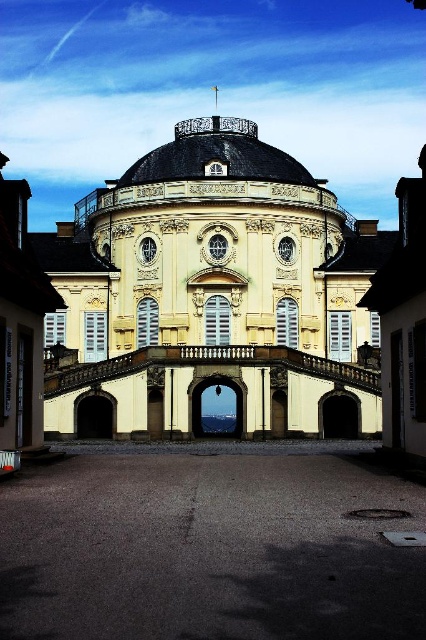
You are standing on the gray asphalt at center looking up at the beige stucco palace at center. Which object is higher in elevation?

The beige stucco palace at center is higher in elevation than the gray asphalt at center because it is positioned above it.

You are an architect planning to install a new lighting system for the beige stucco palace at center and the gray asphalt at center. Which object requires taller light poles to ensure proper illumination?

The beige stucco palace at center requires taller light poles because it has a greater height compared to the gray asphalt at center, necessitating higher placement for effective lighting.